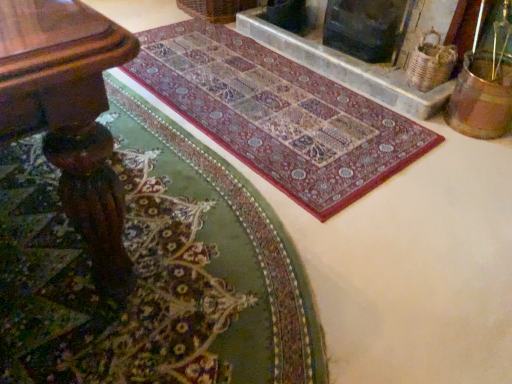
What is the approximate width of multicolored woven rug at center, which is counted as the second mat, starting from the back?

multicolored woven rug at center, which is counted as the second mat, starting from the back, is 37.90 inches in width.

This screenshot has height=384, width=512. I want to click on wooden table at lower left, so click(70, 116).

Identify the location of marble fireplace at upper center, which is the second fireplace in right-to-left order. pyautogui.click(x=361, y=60).

Locate an element on the screen. The image size is (512, 384). mat below the carpet with intricate patterns at center, the 2th mat in the front-to-back sequence (from the image's perspective) is located at coordinates (153, 271).

In terms of size, does carpet with intricate patterns at center, the 2th mat in the front-to-back sequence, appear bigger or smaller than multicolored woven rug at center, marked as the first mat in a front-to-back arrangement?

In the image, carpet with intricate patterns at center, the 2th mat in the front-to-back sequence, appears to be smaller than multicolored woven rug at center, marked as the first mat in a front-to-back arrangement.

From a real-world perspective, is carpet with intricate patterns at center, the 2th mat in the front-to-back sequence, located higher than multicolored woven rug at center, which is counted as the second mat, starting from the back?

No, from a real-world perspective, carpet with intricate patterns at center, the 2th mat in the front-to-back sequence, is not over multicolored woven rug at center, which is counted as the second mat, starting from the back

Can you tell me how much carpet with intricate patterns at center, the 2th mat in the front-to-back sequence, and multicolored woven rug at center, marked as the first mat in a front-to-back arrangement, differ in facing direction?

carpet with intricate patterns at center, the 2th mat in the front-to-back sequence, and multicolored woven rug at center, marked as the first mat in a front-to-back arrangement, are facing 1.25 degrees away from each other.

Is wooden table at lower left located within dark gray stone fireplace at upper center, which is the second fireplace in left-to-right order?

No.

Between dark gray stone fireplace at upper center, acting as the first fireplace starting from the right, and wooden table at lower left, which one has larger size?

wooden table at lower left.

Relative to wooden table at lower left, is dark gray stone fireplace at upper center, which is the second fireplace in left-to-right order, in front or behind?

Visually, dark gray stone fireplace at upper center, which is the second fireplace in left-to-right order, is located behind wooden table at lower left.

Find the location of `table below the dark gray stone fireplace at upper center, acting as the first fireplace starting from the right (from the image's perspective)`. table below the dark gray stone fireplace at upper center, acting as the first fireplace starting from the right (from the image's perspective) is located at coordinates (70, 116).

Between wooden table at lower left and multicolored woven rug at center, marked as the first mat in a front-to-back arrangement, which one has larger width?

With larger width is multicolored woven rug at center, marked as the first mat in a front-to-back arrangement.

Which of these two, wooden table at lower left or multicolored woven rug at center, marked as the first mat in a front-to-back arrangement, stands taller?

wooden table at lower left.

From a real-world perspective, is wooden table at lower left physically above multicolored woven rug at center, marked as the first mat in a front-to-back arrangement?

Yes.

How far apart are wooden table at lower left and multicolored woven rug at center, marked as the first mat in a front-to-back arrangement?

17.01 inches.

Are dark gray stone fireplace at upper center, which is the second fireplace in left-to-right order, and marble fireplace at upper center, which ranks as the 1th fireplace in left-to-right order, making contact?

dark gray stone fireplace at upper center, which is the second fireplace in left-to-right order, and marble fireplace at upper center, which ranks as the 1th fireplace in left-to-right order, are not in contact.

Considering the sizes of objects dark gray stone fireplace at upper center, which is the second fireplace in left-to-right order, and marble fireplace at upper center, which ranks as the 1th fireplace in left-to-right order, in the image provided, who is taller, dark gray stone fireplace at upper center, which is the second fireplace in left-to-right order, or marble fireplace at upper center, which ranks as the 1th fireplace in left-to-right order,?

With more height is dark gray stone fireplace at upper center, which is the second fireplace in left-to-right order.

Is point (379, 62) closer or farther from the camera than point (241, 25)?

Clearly, point (379, 62) is closer to the camera than point (241, 25).

Who is smaller, dark gray stone fireplace at upper center, which is the second fireplace in left-to-right order, or marble fireplace at upper center, which ranks as the 1th fireplace in left-to-right order?

With smaller size is marble fireplace at upper center, which ranks as the 1th fireplace in left-to-right order.

From the image's perspective, which object appears higher, marble fireplace at upper center, which ranks as the 1th fireplace in left-to-right order, or dark gray stone fireplace at upper center, which is the second fireplace in left-to-right order?

From the image's view, dark gray stone fireplace at upper center, which is the second fireplace in left-to-right order, is above.

In the image, is marble fireplace at upper center, which is the second fireplace in right-to-left order, positioned in front of or behind dark gray stone fireplace at upper center, acting as the first fireplace starting from the right?

In the image, marble fireplace at upper center, which is the second fireplace in right-to-left order, appears in front of dark gray stone fireplace at upper center, acting as the first fireplace starting from the right.

From a real-world perspective, which object rests below the other?

In real-world perspective, marble fireplace at upper center, which ranks as the 1th fireplace in left-to-right order, is lower.

Which of these two, marble fireplace at upper center, which is the second fireplace in right-to-left order, or dark gray stone fireplace at upper center, acting as the first fireplace starting from the right, is wider?

marble fireplace at upper center, which is the second fireplace in right-to-left order, is wider.

Is multicolored woven rug at center, marked as the first mat in a front-to-back arrangement, bigger than marble fireplace at upper center, which is the second fireplace in right-to-left order?

Correct, multicolored woven rug at center, marked as the first mat in a front-to-back arrangement, is larger in size than marble fireplace at upper center, which is the second fireplace in right-to-left order.

Between multicolored woven rug at center, which is counted as the second mat, starting from the back, and marble fireplace at upper center, which ranks as the 1th fireplace in left-to-right order, which one has larger width?

Wider between the two is multicolored woven rug at center, which is counted as the second mat, starting from the back.

From a real-world perspective, is multicolored woven rug at center, marked as the first mat in a front-to-back arrangement, on marble fireplace at upper center, which ranks as the 1th fireplace in left-to-right order?

→ Incorrect, from a real-world perspective, multicolored woven rug at center, marked as the first mat in a front-to-back arrangement, is lower than marble fireplace at upper center, which ranks as the 1th fireplace in left-to-right order.

From a real-world perspective, is wooden table at lower left on top of marble fireplace at upper center, which ranks as the 1th fireplace in left-to-right order?

Yes.

Is wooden table at lower left far from marble fireplace at upper center, which ranks as the 1th fireplace in left-to-right order?

Yes.

How different are the orientations of wooden table at lower left and marble fireplace at upper center, which ranks as the 1th fireplace in left-to-right order, in degrees?

0.136 degrees separate the facing orientations of wooden table at lower left and marble fireplace at upper center, which ranks as the 1th fireplace in left-to-right order.

Relative to marble fireplace at upper center, which is the second fireplace in right-to-left order, is wooden table at lower left in front or behind?

wooden table at lower left is in front of marble fireplace at upper center, which is the second fireplace in right-to-left order.

You are a GUI agent. You are given a task and a screenshot of the screen. Output one action in this format:
    pyautogui.click(x=<x>, y=<y>)
    Task: Click on the mat behind the multicolored woven rug at center, marked as the first mat in a front-to-back arrangement
    
    Given the screenshot: What is the action you would take?
    [278, 114]

At what (x,y) coordinates should I click in order to perform the action: click on table located below the dark gray stone fireplace at upper center, which is the second fireplace in left-to-right order (from the image's perspective). Please return your answer as a coordinate pair (x, y). Looking at the image, I should click on (70, 116).

Looking at the image, which one is located further to carpet with intricate patterns at center, the 2th mat in the front-to-back sequence, wooden table at lower left or multicolored woven rug at center, marked as the first mat in a front-to-back arrangement?

wooden table at lower left is positioned further to the anchor carpet with intricate patterns at center, the 2th mat in the front-to-back sequence.

Looking at the image, which one is located closer to multicolored woven rug at center, marked as the first mat in a front-to-back arrangement, marble fireplace at upper center, which is the second fireplace in right-to-left order, or carpet with intricate patterns at center, the 1th mat in the back-to-front sequence?

carpet with intricate patterns at center, the 1th mat in the back-to-front sequence, is closer to multicolored woven rug at center, marked as the first mat in a front-to-back arrangement.

When comparing their distances from carpet with intricate patterns at center, the 2th mat in the front-to-back sequence, does multicolored woven rug at center, marked as the first mat in a front-to-back arrangement, or wooden table at lower left seem closer?

multicolored woven rug at center, marked as the first mat in a front-to-back arrangement, lies closer to carpet with intricate patterns at center, the 2th mat in the front-to-back sequence, than the other object.

From the image, which object appears to be nearer to wooden table at lower left, carpet with intricate patterns at center, the 1th mat in the back-to-front sequence, or multicolored woven rug at center, marked as the first mat in a front-to-back arrangement?

multicolored woven rug at center, marked as the first mat in a front-to-back arrangement.

When comparing their distances from wooden table at lower left, does marble fireplace at upper center, which is the second fireplace in right-to-left order, or multicolored woven rug at center, marked as the first mat in a front-to-back arrangement, seem further?

marble fireplace at upper center, which is the second fireplace in right-to-left order, is positioned further to the anchor wooden table at lower left.

Based on their spatial positions, is marble fireplace at upper center, which ranks as the 1th fireplace in left-to-right order, or wooden table at lower left further from carpet with intricate patterns at center, the 2th mat in the front-to-back sequence?

wooden table at lower left is positioned further to the anchor carpet with intricate patterns at center, the 2th mat in the front-to-back sequence.

Which object lies further to the anchor point multicolored woven rug at center, marked as the first mat in a front-to-back arrangement, dark gray stone fireplace at upper center, which is the second fireplace in left-to-right order, or wooden table at lower left?

Among the two, dark gray stone fireplace at upper center, which is the second fireplace in left-to-right order, is located further to multicolored woven rug at center, marked as the first mat in a front-to-back arrangement.

When comparing their distances from marble fireplace at upper center, which ranks as the 1th fireplace in left-to-right order, does multicolored woven rug at center, marked as the first mat in a front-to-back arrangement, or dark gray stone fireplace at upper center, which is the second fireplace in left-to-right order, seem further?

Among the two, multicolored woven rug at center, marked as the first mat in a front-to-back arrangement, is located further to marble fireplace at upper center, which ranks as the 1th fireplace in left-to-right order.

Locate an element on the screen. Image resolution: width=512 pixels, height=384 pixels. mat between multicolored woven rug at center, which is counted as the second mat, starting from the back, and dark gray stone fireplace at upper center, which is the second fireplace in left-to-right order, along the z-axis is located at coordinates (278, 114).

Where is `mat between wooden table at lower left and carpet with intricate patterns at center, the 2th mat in the front-to-back sequence, along the z-axis`? The width and height of the screenshot is (512, 384). mat between wooden table at lower left and carpet with intricate patterns at center, the 2th mat in the front-to-back sequence, along the z-axis is located at coordinates (153, 271).

I want to click on fireplace located between multicolored woven rug at center, which is counted as the second mat, starting from the back, and dark gray stone fireplace at upper center, which is the second fireplace in left-to-right order, in the depth direction, so click(361, 60).

Identify the location of fireplace located between wooden table at lower left and dark gray stone fireplace at upper center, which is the second fireplace in left-to-right order, in the depth direction. (361, 60).